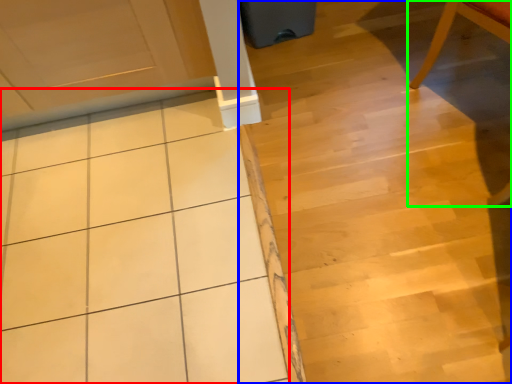
Question: Considering the real-world distances, which object is closest to ceramic tile (highlighted by a red box)? stair (highlighted by a blue box) or chair (highlighted by a green box).

Choices:
 (A) stair
 (B) chair

Answer: (A)